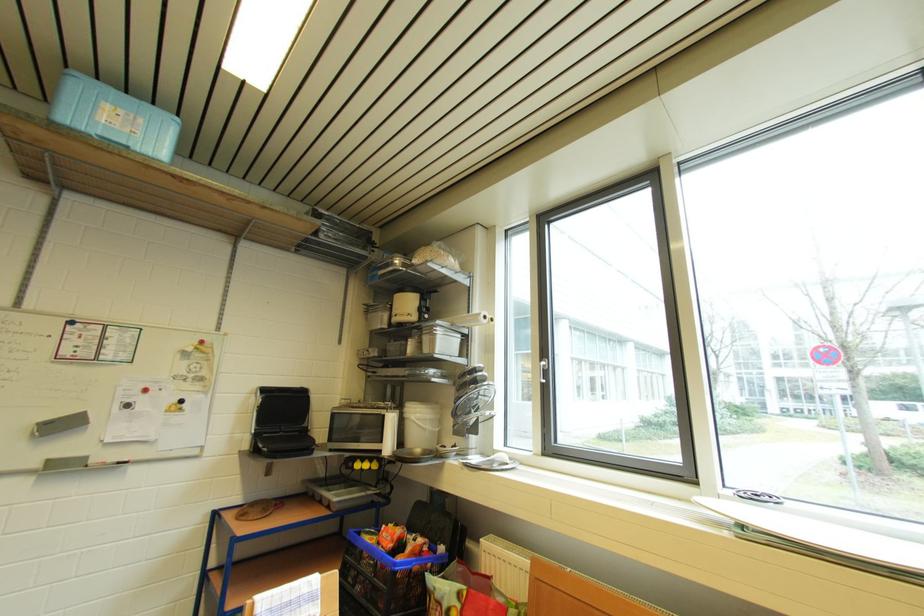
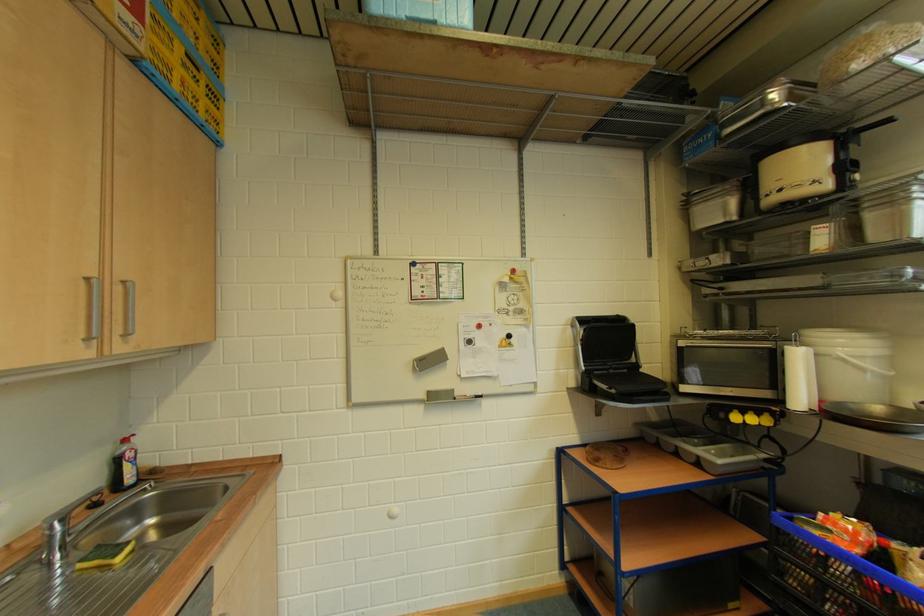
Question: The first image is from the beginning of the video and the second image is from the end. How did the camera likely rotate when shooting the video?

Choices:
 (A) Left
 (B) Right
 (C) Up
 (D) Down

Answer: (A)